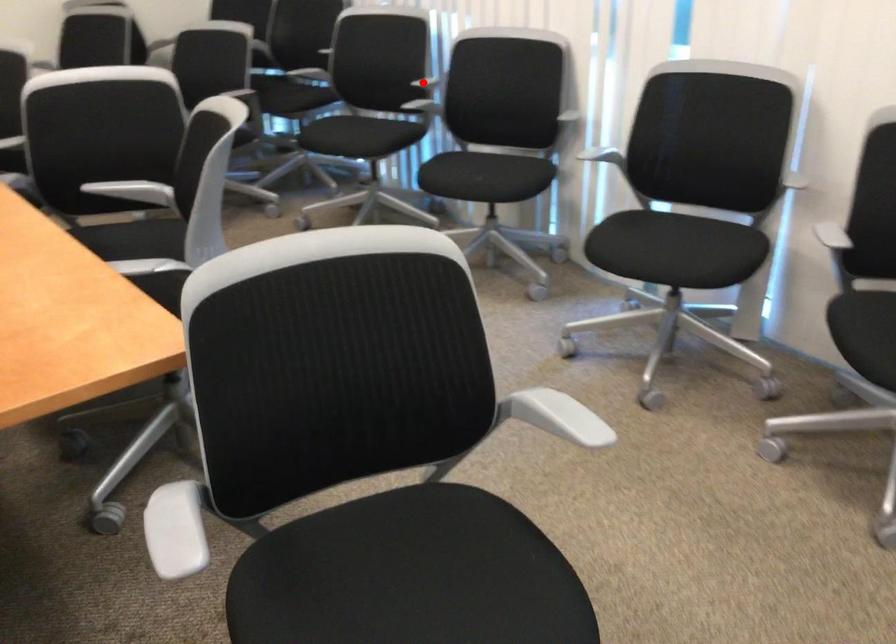
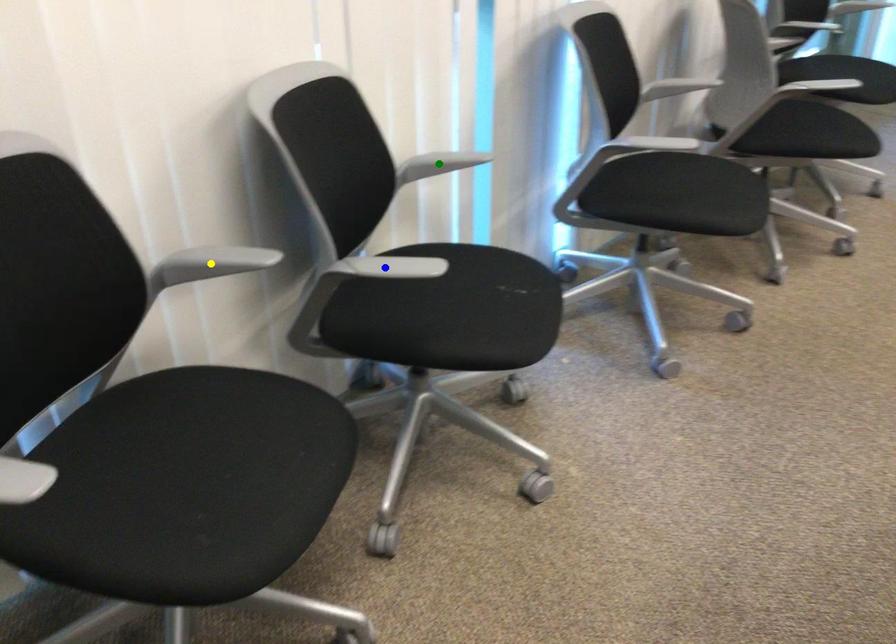
Question: I am providing you with two images of the same scene from different viewpoints. A red point is marked on the first image. You are given multiple points on the second image. Which point in image 2 is actually the same real-world point as the red point in image 1?

Choices:
 (A) blue point
 (B) yellow point
 (C) green point

Answer: (B)